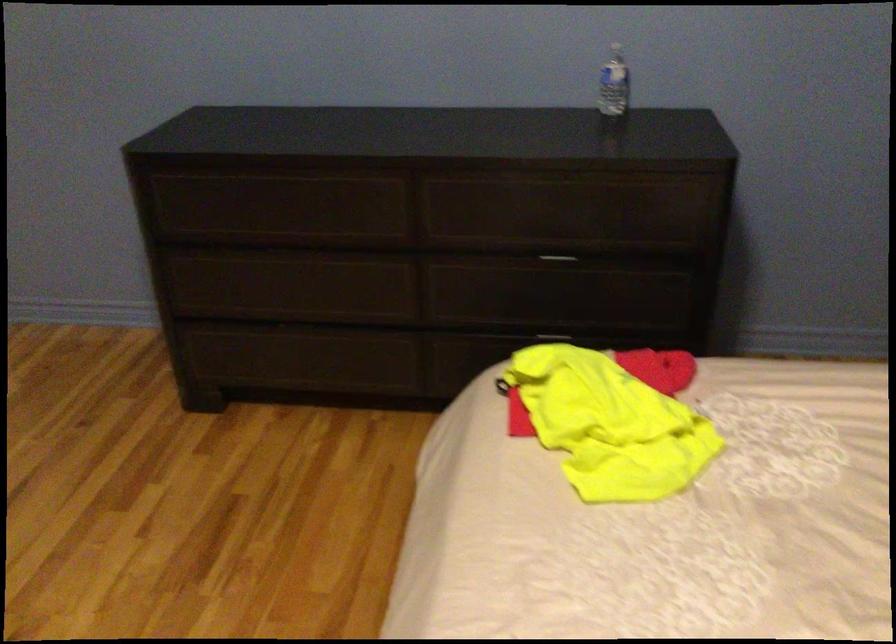
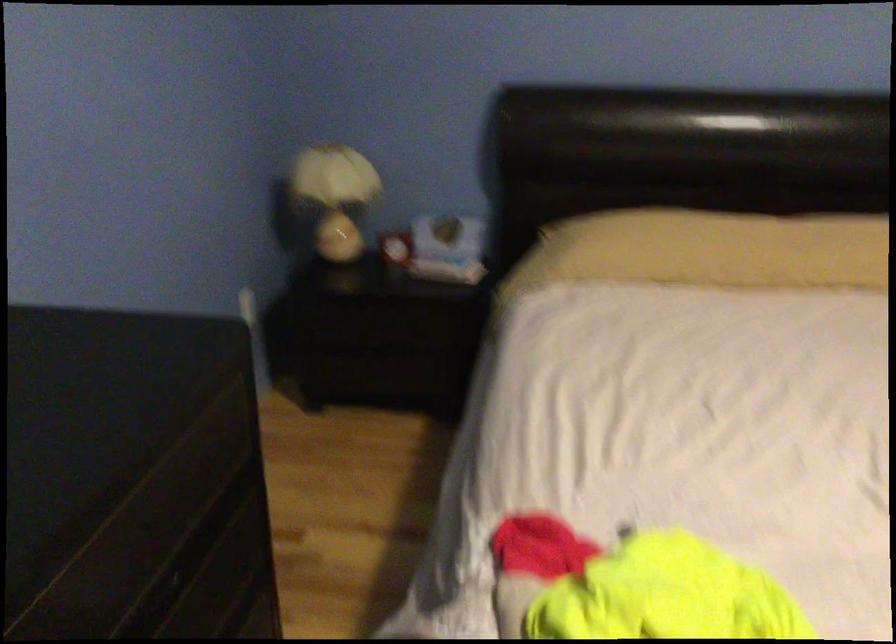
Locate, in the second image, the point that corresponds to point (607, 252) in the first image.

(186, 559)